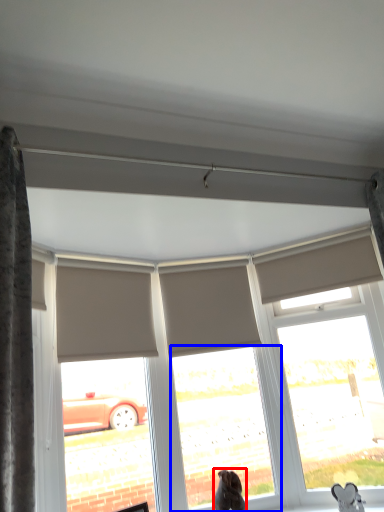
Question: Which object appears closest to the camera in this image, dog (highlighted by a red box) or window (highlighted by a blue box)?

Choices:
 (A) dog
 (B) window

Answer: (A)